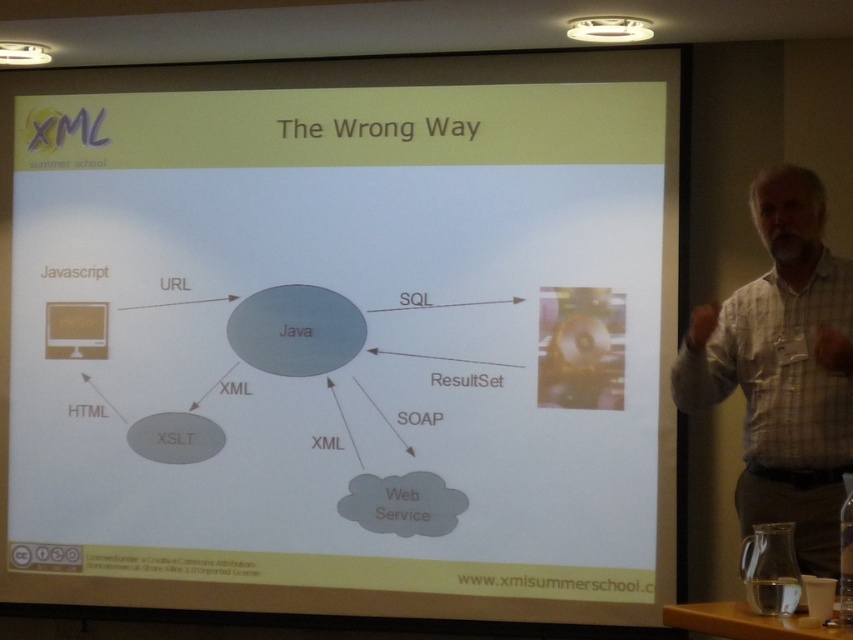
Question: Estimate the real-world distances between objects in this image. Which object is closer to the white checkered shirt at right?

Choices:
 (A) white matte projector screen at upper center
 (B) metallic projector at upper left

Answer: (A)

Question: Does white checkered shirt at right appear over metallic projector at upper left?

Choices:
 (A) no
 (B) yes

Answer: (A)

Question: Estimate the real-world distances between objects in this image. Which object is farther from the white matte projector screen at upper center?

Choices:
 (A) white checkered shirt at right
 (B) metallic projector at upper left

Answer: (B)

Question: Among these objects, which one is farthest from the camera?

Choices:
 (A) white checkered shirt at right
 (B) metallic projector at upper left

Answer: (B)

Question: Can you confirm if white matte projector screen at upper center is positioned to the right of white checkered shirt at right?

Choices:
 (A) yes
 (B) no

Answer: (B)

Question: Considering the relative positions of white matte projector screen at upper center and white checkered shirt at right in the image provided, where is white matte projector screen at upper center located with respect to white checkered shirt at right?

Choices:
 (A) below
 (B) above

Answer: (B)